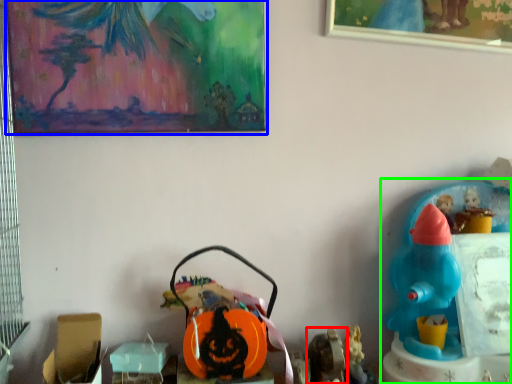
Question: Based on their relative distances, which object is farther from toy (highlighted by a red box)? Choose from picture frame (highlighted by a blue box) and toy (highlighted by a green box).

Choices:
 (A) picture frame
 (B) toy

Answer: (A)